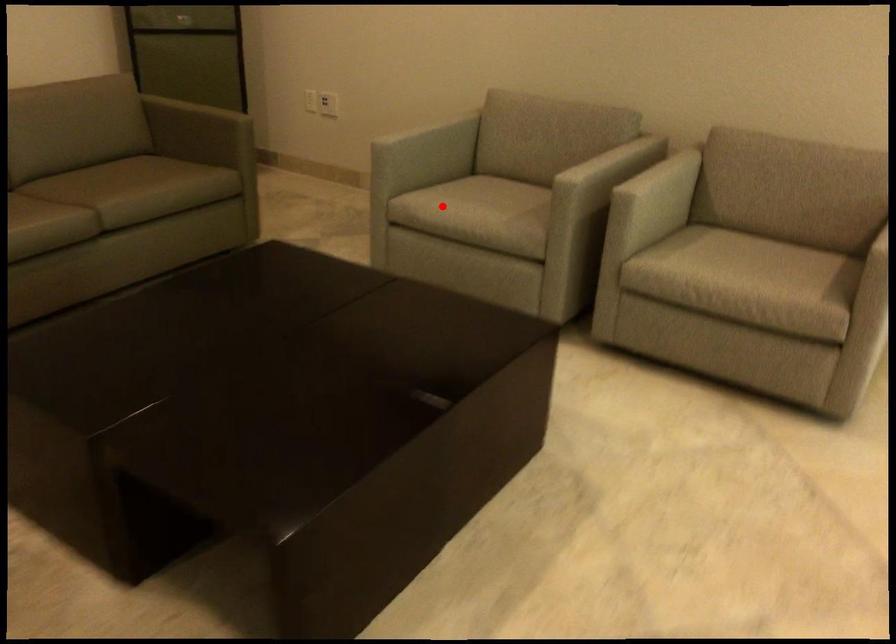
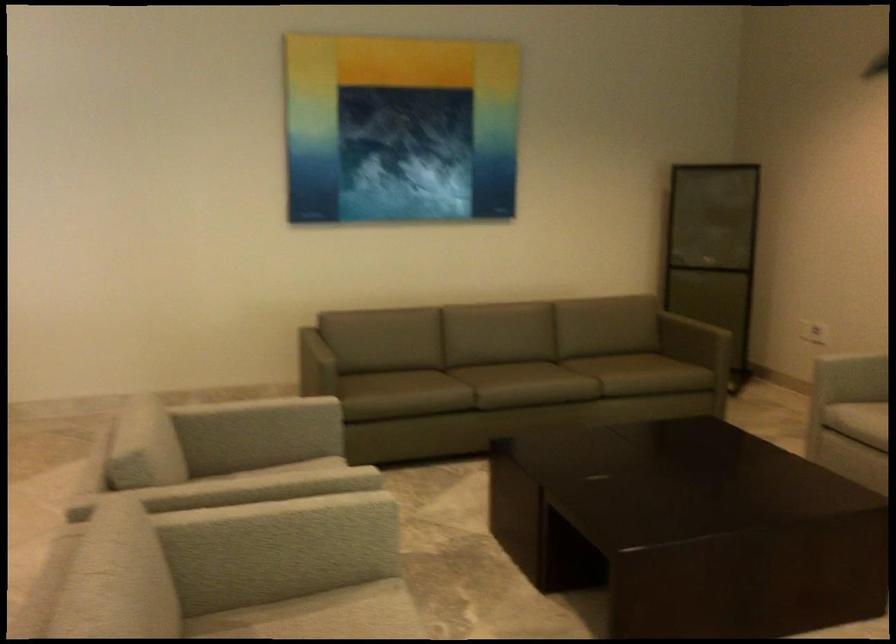
Where in the second image is the point corresponding to the highlighted location from the first image?

(857, 420)